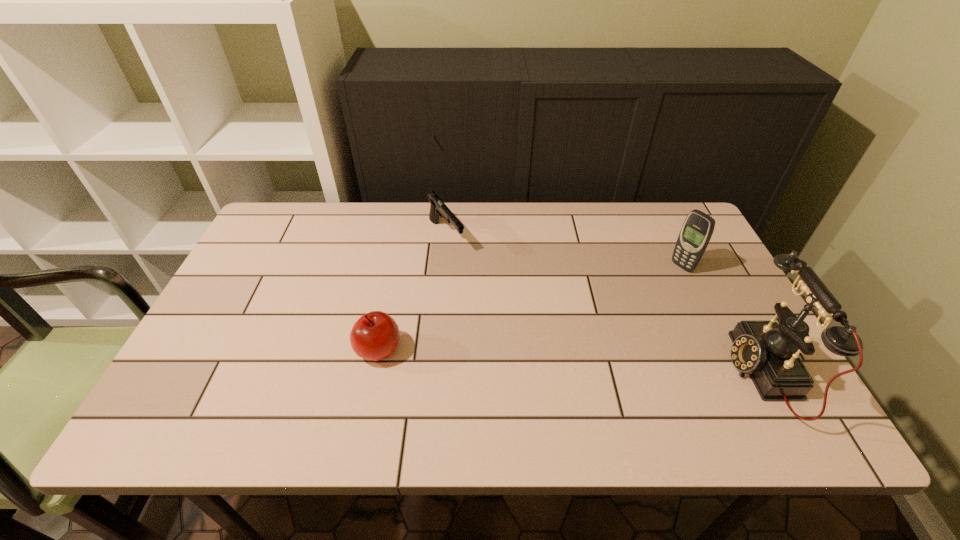
Image resolution: width=960 pixels, height=540 pixels. Identify the location of cellular telephone that is at the right edge. (697, 229).

Image resolution: width=960 pixels, height=540 pixels. In order to click on object that is at the near right corner in this screenshot , I will do coord(768,351).

In the image, there is a desktop. At what (x,y) coordinates should I click in order to perform the action: click on vacant space at the far edge. Please return your answer as a coordinate pair (x, y). The height and width of the screenshot is (540, 960). Looking at the image, I should click on (521, 235).

In the image, there is a desktop. Where is `vacant space at the near edge`? This screenshot has width=960, height=540. vacant space at the near edge is located at coordinates (528, 386).

Where is `vacant space at the right edge of the desktop`? Image resolution: width=960 pixels, height=540 pixels. vacant space at the right edge of the desktop is located at coordinates (665, 264).

This screenshot has width=960, height=540. I want to click on blank space at the far left corner of the desktop, so click(292, 217).

In the image, there is a desktop. Where is `free space at the far right corner`? free space at the far right corner is located at coordinates (675, 224).

The width and height of the screenshot is (960, 540). Identify the location of free spot at the near right corner of the desktop. (720, 374).

Identify the location of free space that is in between the tallest object and the cellular telephone. (722, 320).

Identify the location of free space between the third object from right to left and the tallest object. (604, 304).